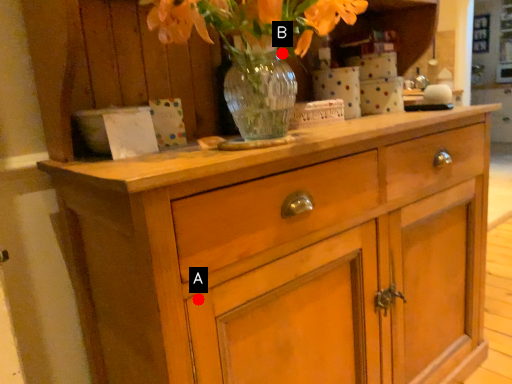
Question: Two points are circled on the image, labeled by A and B beside each circle. Which point is closer to the camera?

Choices:
 (A) A is closer
 (B) B is closer

Answer: (A)